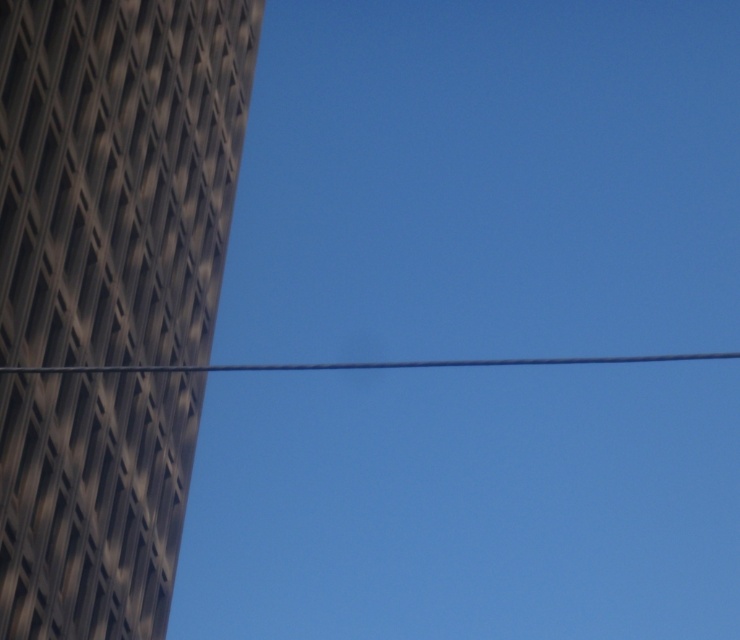
Question: Which of the following is the closest to the observer?

Choices:
 (A) dark brown textured tower at left
 (B) metallic wire at center

Answer: (B)

Question: Is dark brown textured tower at left to the right of metallic wire at center from the viewer's perspective?

Choices:
 (A) yes
 (B) no

Answer: (B)

Question: Observing the image, what is the correct spatial positioning of dark brown textured tower at left in reference to metallic wire at center?

Choices:
 (A) right
 (B) left

Answer: (B)

Question: Which object appears farthest from the camera in this image?

Choices:
 (A) dark brown textured tower at left
 (B) metallic wire at center

Answer: (A)

Question: Which point appears farthest from the camera in this image?

Choices:
 (A) (246, 364)
 (B) (111, 557)

Answer: (A)

Question: Can you confirm if dark brown textured tower at left is thinner than metallic wire at center?

Choices:
 (A) no
 (B) yes

Answer: (B)